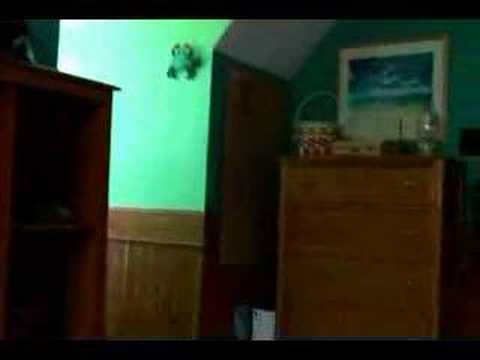
The height and width of the screenshot is (360, 480). I want to click on handles, so click(x=415, y=181), click(x=412, y=223), click(x=410, y=278), click(x=308, y=179), click(x=308, y=229), click(x=303, y=272), click(x=296, y=325), click(x=399, y=329).